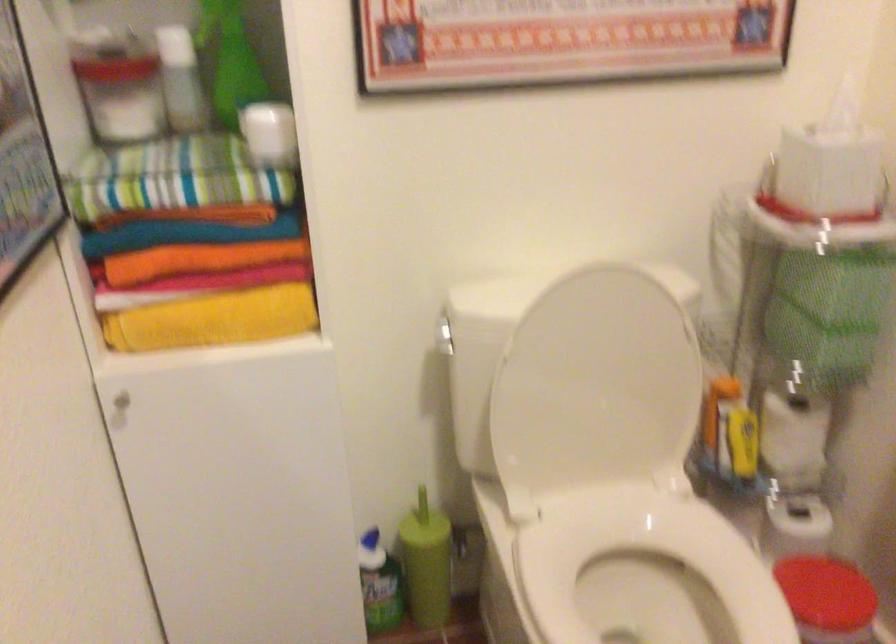
I want to click on white toilet lid, so click(595, 388).